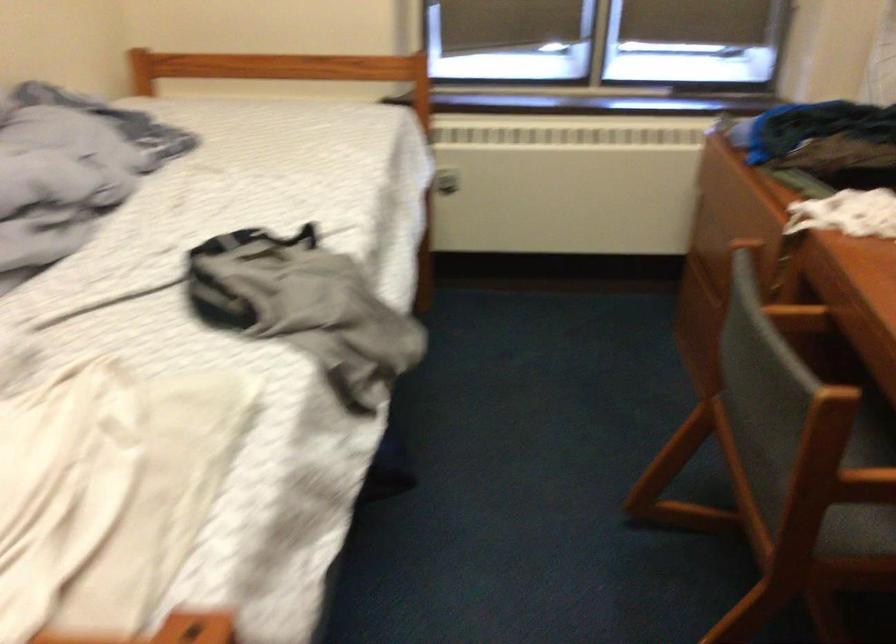
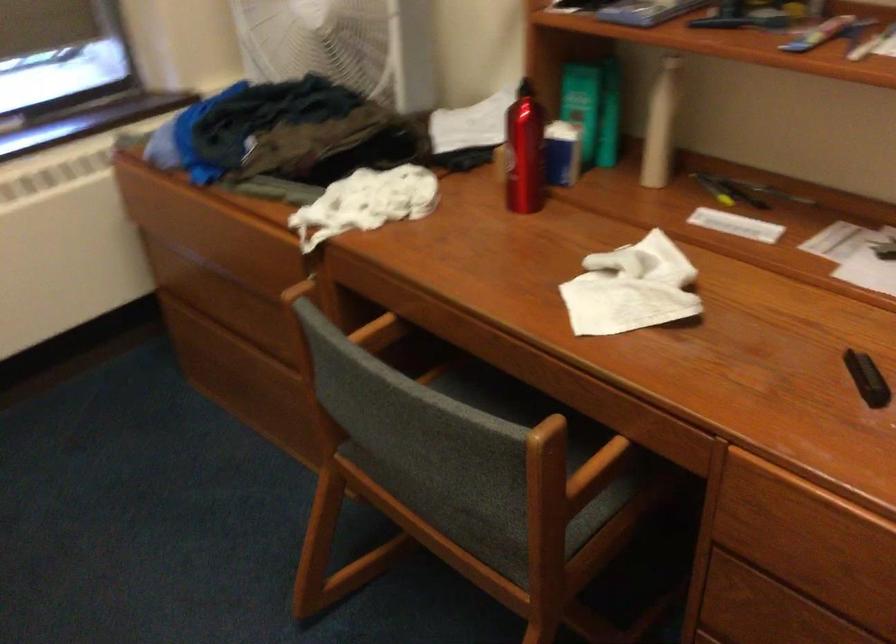
Where in the second image is the point corresponding to the point at 772,462 from the first image?

(488, 509)